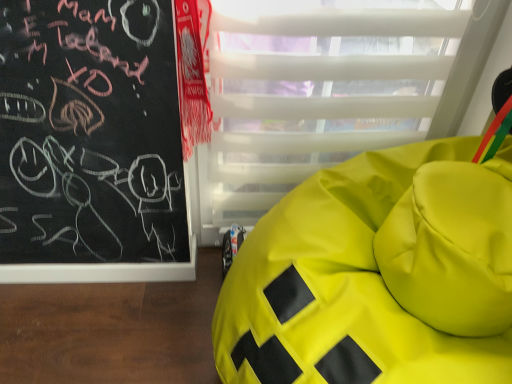
What do you see at coordinates (315, 91) in the screenshot? The image size is (512, 384). I see `transparent plastic glass door at center` at bounding box center [315, 91].

Identify the location of transparent plastic glass door at center. (315, 91).

At what (x,y) coordinates should I click in order to perform the action: click on lime green fabric bean bag at right. Please return your answer as a coordinate pair (x, y). Looking at the image, I should click on (377, 274).

The image size is (512, 384). What do you see at coordinates (377, 274) in the screenshot? I see `lime green fabric bean bag at right` at bounding box center [377, 274].

Where is `transparent plastic glass door at center`? This screenshot has height=384, width=512. transparent plastic glass door at center is located at coordinates (315, 91).

Consider the image. Does lime green fabric bean bag at right appear on the right side of transparent plastic glass door at center?

Yes.

Which object is further away from the camera taking this photo, lime green fabric bean bag at right or transparent plastic glass door at center?

transparent plastic glass door at center.

Considering the positions of points (429, 333) and (261, 207), is point (429, 333) farther from camera compared to point (261, 207)?

No, (429, 333) is closer to viewer.

From the image's perspective, is lime green fabric bean bag at right below transparent plastic glass door at center?

Correct, lime green fabric bean bag at right appears lower than transparent plastic glass door at center in the image.

From a real-world perspective, between lime green fabric bean bag at right and transparent plastic glass door at center, who is vertically lower?

From a 3D spatial view, lime green fabric bean bag at right is below.

Which of these two, lime green fabric bean bag at right or transparent plastic glass door at center, is thinner?

transparent plastic glass door at center is thinner.

Can you confirm if lime green fabric bean bag at right is taller than transparent plastic glass door at center?

Incorrect, the height of lime green fabric bean bag at right is not larger of that of transparent plastic glass door at center.

Can you confirm if lime green fabric bean bag at right is bigger than transparent plastic glass door at center?

Yes.

Choose the correct answer: Is lime green fabric bean bag at right inside transparent plastic glass door at center or outside it?

lime green fabric bean bag at right exists outside the volume of transparent plastic glass door at center.

Are lime green fabric bean bag at right and transparent plastic glass door at center far apart?

No, there isn't a large distance between lime green fabric bean bag at right and transparent plastic glass door at center.

Does lime green fabric bean bag at right turn towards transparent plastic glass door at center?

No, lime green fabric bean bag at right is not aimed at transparent plastic glass door at center.

How different are the orientations of lime green fabric bean bag at right and transparent plastic glass door at center in degrees?

There is a 90-degree angle between the facing directions of lime green fabric bean bag at right and transparent plastic glass door at center.

Where is `glass door on the left of lime green fabric bean bag at right`? glass door on the left of lime green fabric bean bag at right is located at coordinates (315, 91).

Based on the photo, can you confirm if transparent plastic glass door at center is positioned to the left of lime green fabric bean bag at right?

Correct, you'll find transparent plastic glass door at center to the left of lime green fabric bean bag at right.

Is transparent plastic glass door at center in front of or behind lime green fabric bean bag at right in the image?

In the image, transparent plastic glass door at center appears behind lime green fabric bean bag at right.

Is point (426, 0) positioned before point (509, 229)?

No, (426, 0) is behind (509, 229).

From the image's perspective, is transparent plastic glass door at center over lime green fabric bean bag at right?

Yes.

From a real-world perspective, which is physically above, transparent plastic glass door at center or lime green fabric bean bag at right?

Answer: transparent plastic glass door at center is physically above.

Which object is wider, transparent plastic glass door at center or lime green fabric bean bag at right?

Wider between the two is lime green fabric bean bag at right.

Which of these two, transparent plastic glass door at center or lime green fabric bean bag at right, stands taller?

With more height is transparent plastic glass door at center.

Can you confirm if transparent plastic glass door at center is smaller than lime green fabric bean bag at right?

Correct, transparent plastic glass door at center occupies less space than lime green fabric bean bag at right.

Would you say transparent plastic glass door at center is outside lime green fabric bean bag at right?

Yes.

Are transparent plastic glass door at center and lime green fabric bean bag at right beside each other?

They are not placed beside each other.

Based on the photo, is transparent plastic glass door at center looking in the opposite direction of lime green fabric bean bag at right?

Correct, transparent plastic glass door at center is looking away from lime green fabric bean bag at right.

Measure the distance between transparent plastic glass door at center and lime green fabric bean bag at right.

They are 38.56 centimeters apart.

The width and height of the screenshot is (512, 384). I want to click on furniture to the right of transparent plastic glass door at center, so click(377, 274).

What are the coordinates of `glass door above the lime green fabric bean bag at right (from the image's perspective)` in the screenshot? It's located at point(315,91).

Locate an element on the screen. furniture that is below the transparent plastic glass door at center (from the image's perspective) is located at coordinates (377, 274).